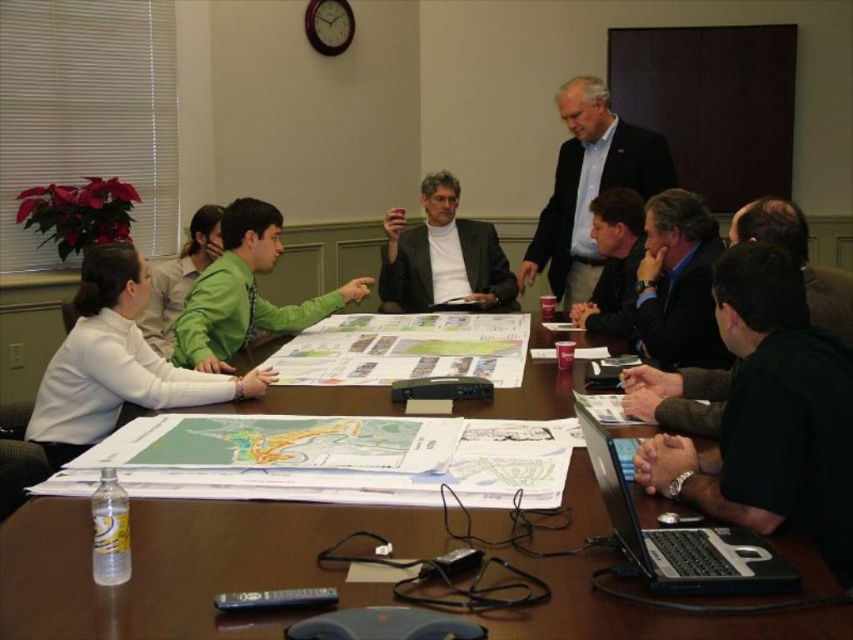
Between point (96, 348) and point (556, 269), which one is positioned in front?

Point (96, 348)

Identify the location of white shirt at upper left. (115, 362).

Looking at this image, who is positioned more to the right, blue shirt at upper center or green matte shirt at upper left?

blue shirt at upper center is more to the right.

Does blue shirt at upper center have a greater height compared to green matte shirt at upper left?

Correct, blue shirt at upper center is much taller as green matte shirt at upper left.

Is point (654, 138) positioned after point (166, 262)?

That is True.

Identify the location of blue shirt at upper center. This screenshot has width=853, height=640. (589, 186).

Which of these two, black plastic laptop at lower right or green matte shirt at center, stands taller?

green matte shirt at center is taller.

Describe the element at coordinates (677, 532) in the screenshot. The width and height of the screenshot is (853, 640). I see `black plastic laptop at lower right` at that location.

The width and height of the screenshot is (853, 640). What do you see at coordinates (677, 532) in the screenshot?
I see `black plastic laptop at lower right` at bounding box center [677, 532].

In order to click on black plastic laptop at lower right in this screenshot , I will do `click(677, 532)`.